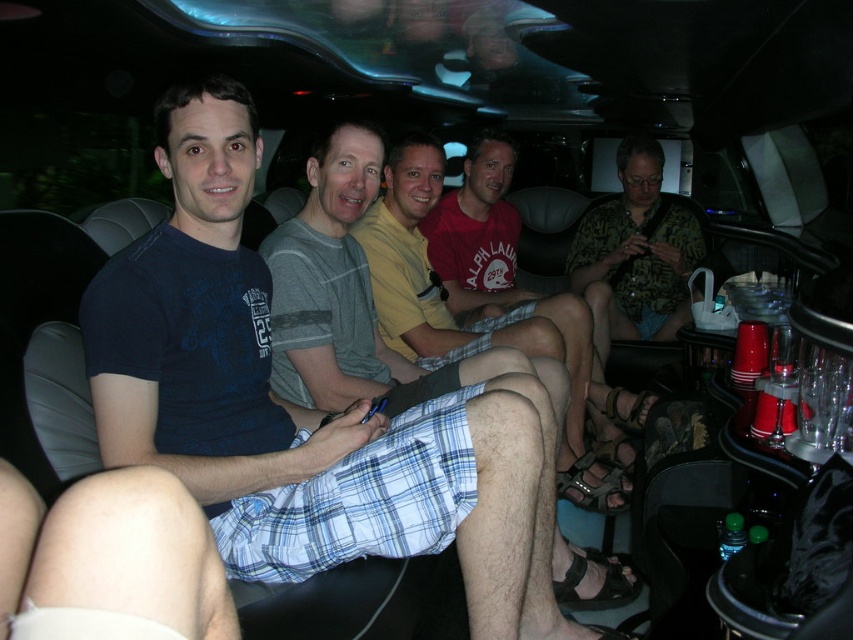
Is gray cotton t-shirt at center positioned in front of printed fabric shirt at center?

Yes, it is.

Is gray cotton t-shirt at center further to camera compared to printed fabric shirt at center?

No, it is not.

Is point (294, 278) positioned behind point (674, 330)?

No, (294, 278) is in front of (674, 330).

Locate an element on the screen. Image resolution: width=853 pixels, height=640 pixels. gray cotton t-shirt at center is located at coordinates (357, 298).